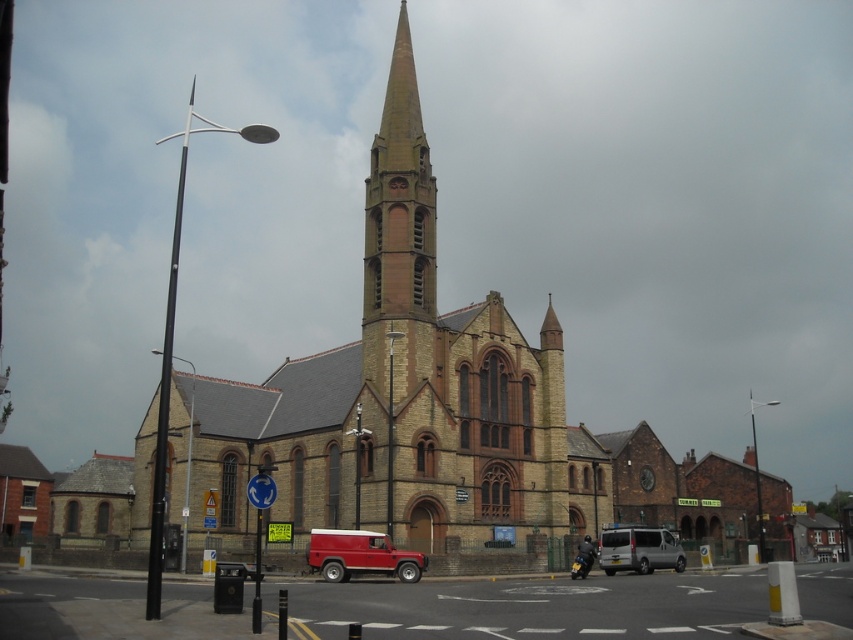
You are a tourist standing on the street in front of the brick church at center and the brown brick tower at center. Which structure should you take a photo of to capture the entire building in one frame without zooming? Explain your choice based on their sizes.

The brick church at center is larger in size than the brown brick tower at center, so you should take a photo of the brown brick tower at center to capture the entire building in one frame without zooming because it is smaller and fits better within the camera frame.

You are a photographer standing on the sidewalk. You want to capture a photo of the brown brick tower at center and the silver metallic van at center in the same frame. Which object will appear taller in the photo?

The brown brick tower at center will appear taller in the photo because it has a greater height compared to the silver metallic van at center.